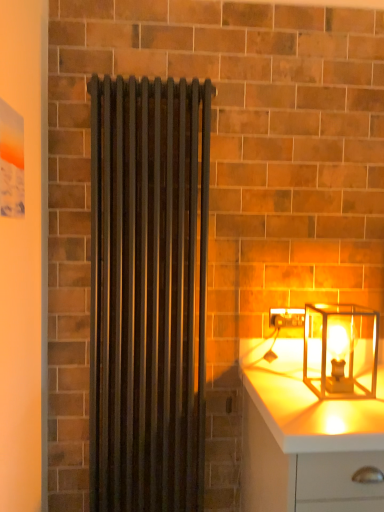
At what (x,y) coordinates should I click in order to perform the action: click on blank area beneath translucent glass lantern at right (from a real-world perspective). Please return your answer as a coordinate pair (x, y). The image size is (384, 512). Looking at the image, I should click on (343, 388).